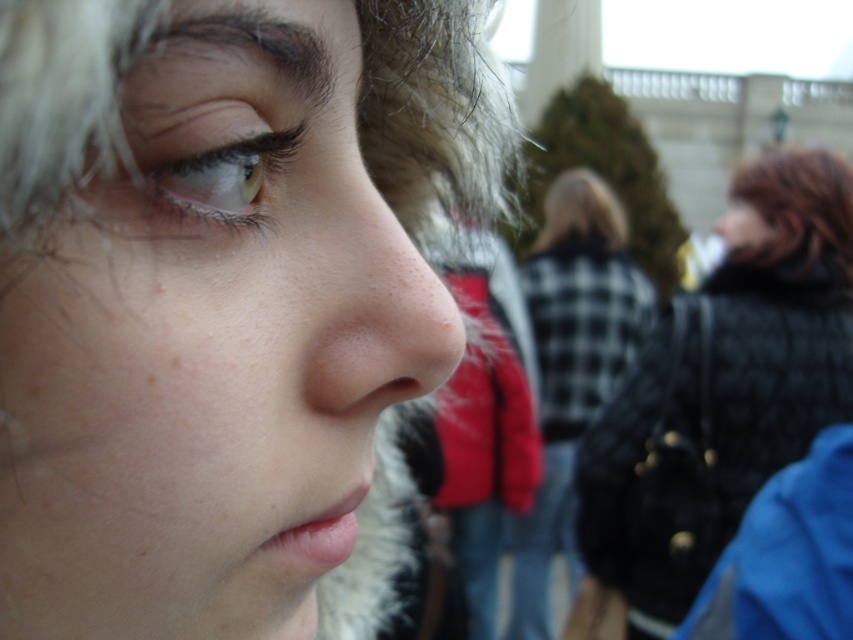
You are a fashion designer observing the image. You need to determine which coat, the black quilted coat at upper right or the plaid fabric coat at center, would be more suitable for a tall model. Based on the description, which one would you choose?

The black quilted coat at upper right is much taller than the plaid fabric coat at center, so it would be more suitable for a tall model.

You are a photographer standing in a park and you notice two coats in the background of your shot. The black quilted coat at upper right and the plaid fabric coat at center. How far apart are these two coats in meters?

The black quilted coat at upper right and the plaid fabric coat at center are 6.25 meters apart from each other.